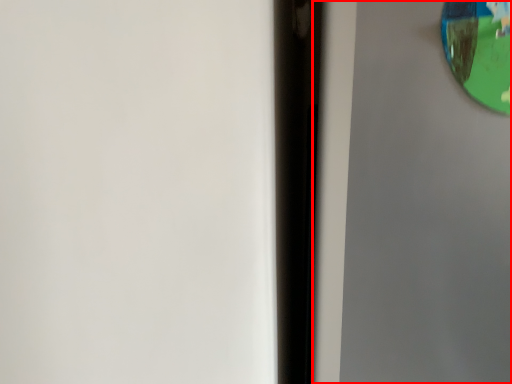
Question: Considering the relative positions of screen door (annotated by the red box) and view mirror in the image provided, where is screen door (annotated by the red box) located with respect to the staircase?

Choices:
 (A) left
 (B) right

Answer: (B)